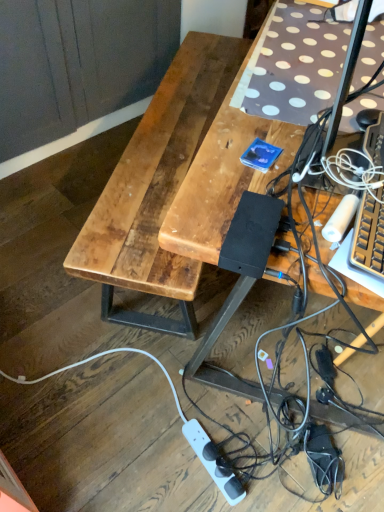
Question: Is the position of wooden desk at center less distant than that of white plastic power strip at lower center?

Choices:
 (A) yes
 (B) no

Answer: (A)

Question: Is wooden desk at center surrounding white plastic power strip at lower center?

Choices:
 (A) no
 (B) yes

Answer: (A)

Question: Considering the relative sizes of wooden desk at center and white plastic power strip at lower center in the image provided, is wooden desk at center thinner than white plastic power strip at lower center?

Choices:
 (A) no
 (B) yes

Answer: (A)

Question: Would you consider wooden desk at center to be distant from white plastic power strip at lower center?

Choices:
 (A) yes
 (B) no

Answer: (B)

Question: From a real-world perspective, is wooden desk at center over white plastic power strip at lower center?

Choices:
 (A) no
 (B) yes

Answer: (B)

Question: Considering the relative sizes of wooden desk at center and white plastic power strip at lower center in the image provided, is wooden desk at center taller than white plastic power strip at lower center?

Choices:
 (A) no
 (B) yes

Answer: (B)

Question: From the image's perspective, would you say white plastic power strip at lower center is shown under wooden desk at center?

Choices:
 (A) no
 (B) yes

Answer: (B)

Question: From a real-world perspective, is white plastic power strip at lower center on top of wooden desk at center?

Choices:
 (A) yes
 (B) no

Answer: (B)

Question: Is white plastic power strip at lower center positioned beyond the bounds of wooden desk at center?

Choices:
 (A) yes
 (B) no

Answer: (A)

Question: Is the depth of white plastic power strip at lower center less than that of wooden desk at center?

Choices:
 (A) no
 (B) yes

Answer: (A)

Question: Considering the relative positions of white plastic power strip at lower center and wooden desk at center in the image provided, is white plastic power strip at lower center to the left of wooden desk at center from the viewer's perspective?

Choices:
 (A) yes
 (B) no

Answer: (A)

Question: From the image's perspective, is white plastic power strip at lower center on wooden desk at center?

Choices:
 (A) yes
 (B) no

Answer: (B)

Question: Which is correct: wooden desk at center is inside white plastic power strip at lower center, or outside of it?

Choices:
 (A) outside
 (B) inside

Answer: (A)